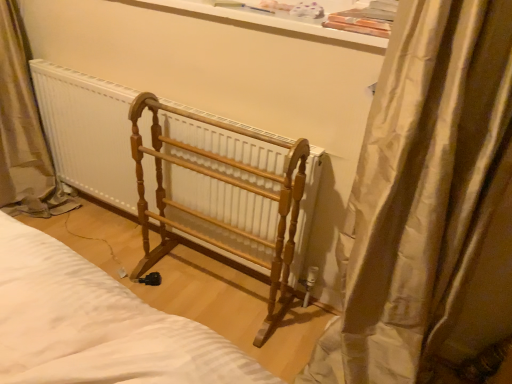
Question: Considering the relative sizes of light brown wood rack at center and white glossy window sill at upper center in the image provided, is light brown wood rack at center wider than white glossy window sill at upper center?

Choices:
 (A) no
 (B) yes

Answer: (B)

Question: Is the surface of light brown wood rack at center in direct contact with white glossy window sill at upper center?

Choices:
 (A) yes
 (B) no

Answer: (B)

Question: Does light brown wood rack at center have a larger size compared to white glossy window sill at upper center?

Choices:
 (A) no
 (B) yes

Answer: (B)

Question: From a real-world perspective, is light brown wood rack at center under white glossy window sill at upper center?

Choices:
 (A) yes
 (B) no

Answer: (A)

Question: Does light brown wood rack at center have a greater height compared to white glossy window sill at upper center?

Choices:
 (A) no
 (B) yes

Answer: (B)

Question: Is light brown wood rack at center closer to the viewer compared to white glossy window sill at upper center?

Choices:
 (A) yes
 (B) no

Answer: (A)

Question: From the image's perspective, would you say silky beige curtain at right is shown under white glossy window sill at upper center?

Choices:
 (A) yes
 (B) no

Answer: (A)

Question: Does silky beige curtain at right appear on the right side of white glossy window sill at upper center?

Choices:
 (A) yes
 (B) no

Answer: (A)

Question: Is silky beige curtain at right outside of white glossy window sill at upper center?

Choices:
 (A) yes
 (B) no

Answer: (A)

Question: Can white glossy window sill at upper center be found inside silky beige curtain at right?

Choices:
 (A) no
 (B) yes

Answer: (A)

Question: Can you confirm if silky beige curtain at right is wider than white glossy window sill at upper center?

Choices:
 (A) no
 (B) yes

Answer: (B)

Question: Can you confirm if silky beige curtain at right is thinner than white glossy window sill at upper center?

Choices:
 (A) no
 (B) yes

Answer: (A)

Question: Is white glossy window sill at upper center far away from wooden radiator at center?

Choices:
 (A) yes
 (B) no

Answer: (B)